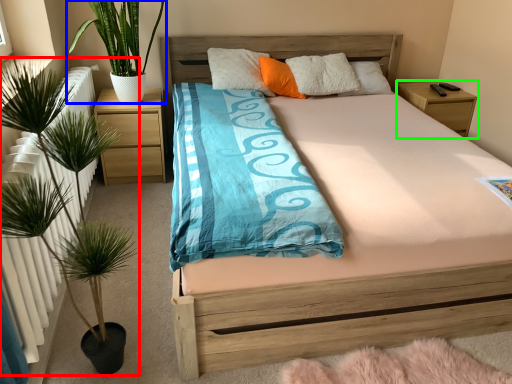
Question: Which object is the farthest from houseplant (highlighted by a red box)? Choose among these: houseplant (highlighted by a blue box) or nightstand (highlighted by a green box).

Choices:
 (A) houseplant
 (B) nightstand

Answer: (B)